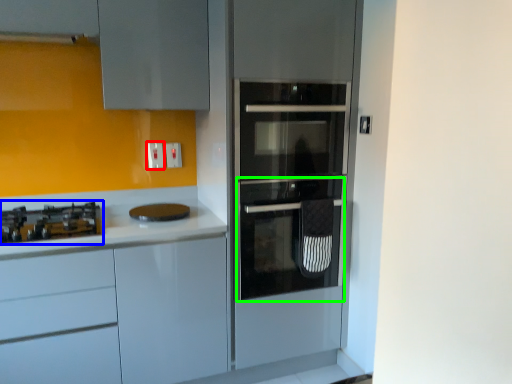
Question: Based on their relative distances, which object is nearer to electric outlet (highlighted by a red box)? Choose from gas stove (highlighted by a blue box) and oven (highlighted by a green box).

Choices:
 (A) gas stove
 (B) oven

Answer: (A)